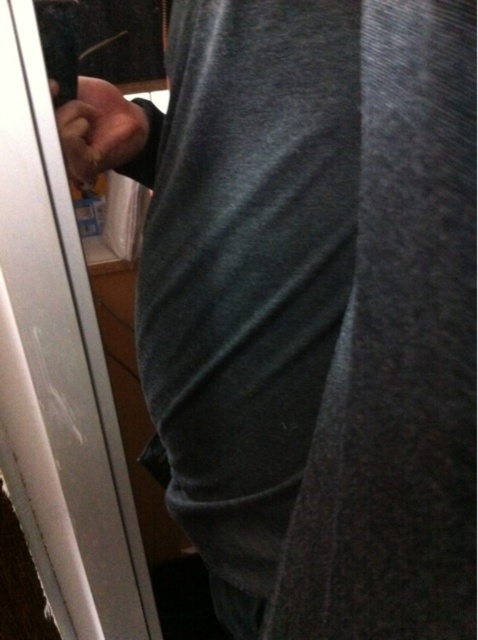
You are a delivery person trying to deliver a package. You see the white glossy door at left and the smooth skin hand at upper left. Which object is wider?

The white glossy door at left might be wider than the smooth skin hand at upper left according to the description.

You are standing in a room and see a point at coordinates (58, 372). Based on the scene description, what object is located at that point?

The point (58, 372) corresponds to the white glossy door at left.

You are a delivery person trying to locate the correct door to deliver a package. You see the white glossy door at left in the image. Can you determine its exact coordinates to ensure accurate delivery?

The white glossy door at left is located at coordinates point (58, 372).